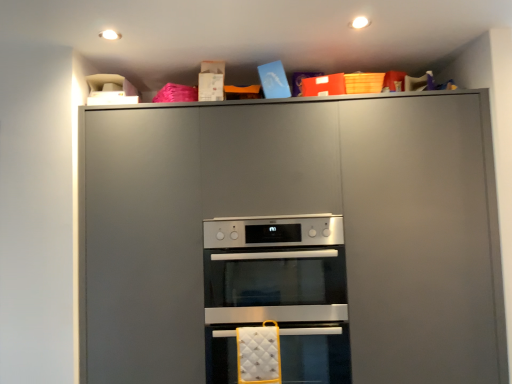
Question: Should I look upward or downward to see satin silver oven at center, placed as the 2th oven when sorted from bottom to top?

Choices:
 (A) down
 (B) up

Answer: (A)

Question: From the image's perspective, is satin silver oven at center, positioned as the first oven in top-to-bottom order, located beneath silver metallic oven at center, which is the first oven from bottom to top?

Choices:
 (A) yes
 (B) no

Answer: (B)

Question: Can you confirm if satin silver oven at center, placed as the 2th oven when sorted from bottom to top, is bigger than silver metallic oven at center, which is the first oven from bottom to top?

Choices:
 (A) no
 (B) yes

Answer: (A)

Question: Is satin silver oven at center, placed as the 2th oven when sorted from bottom to top, closer to camera compared to silver metallic oven at center, the second oven viewed from the top?

Choices:
 (A) no
 (B) yes

Answer: (A)

Question: Can you confirm if satin silver oven at center, positioned as the first oven in top-to-bottom order, is taller than silver metallic oven at center, the second oven viewed from the top?

Choices:
 (A) yes
 (B) no

Answer: (B)

Question: Would you consider satin silver oven at center, placed as the 2th oven when sorted from bottom to top, to be distant from silver metallic oven at center, which is the first oven from bottom to top?

Choices:
 (A) yes
 (B) no

Answer: (B)

Question: Is satin silver oven at center, placed as the 2th oven when sorted from bottom to top, outside silver metallic oven at center, the second oven viewed from the top?

Choices:
 (A) no
 (B) yes

Answer: (B)

Question: Would you say matte gray cabinet at upper center is a long distance from silver metallic oven at center, the second oven viewed from the top?

Choices:
 (A) no
 (B) yes

Answer: (A)

Question: Is matte gray cabinet at upper center behind silver metallic oven at center, the second oven viewed from the top?

Choices:
 (A) no
 (B) yes

Answer: (A)

Question: Could you tell me if matte gray cabinet at upper center is turned towards silver metallic oven at center, which is the first oven from bottom to top?

Choices:
 (A) no
 (B) yes

Answer: (B)

Question: Can you confirm if matte gray cabinet at upper center is positioned to the left of silver metallic oven at center, which is the first oven from bottom to top?

Choices:
 (A) no
 (B) yes

Answer: (A)

Question: Is matte gray cabinet at upper center bigger than silver metallic oven at center, the second oven viewed from the top?

Choices:
 (A) no
 (B) yes

Answer: (B)

Question: Could silver metallic oven at center, which is the first oven from bottom to top, be considered to be inside matte gray cabinet at upper center?

Choices:
 (A) yes
 (B) no

Answer: (A)

Question: Considering the relative positions of satin silver oven at center, positioned as the first oven in top-to-bottom order, and matte gray cabinet at upper center in the image provided, is satin silver oven at center, positioned as the first oven in top-to-bottom order, behind matte gray cabinet at upper center?

Choices:
 (A) no
 (B) yes

Answer: (B)